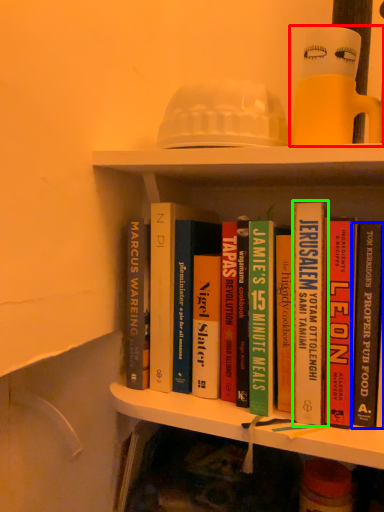
Question: Considering the real-world distances, which object is closest to toy (highlighted by a red box)? book (highlighted by a blue box) or book (highlighted by a green box).

Choices:
 (A) book
 (B) book

Answer: (B)